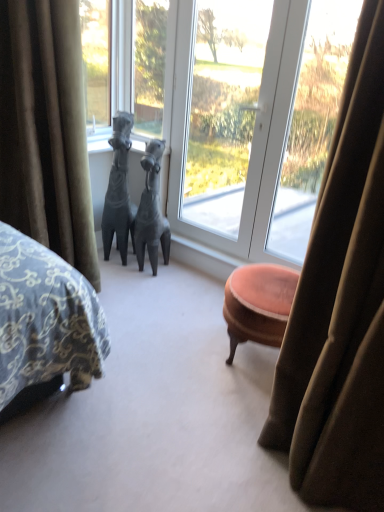
You are a GUI agent. You are given a task and a screenshot of the screen. Output one action in this format:
    pyautogui.click(x=<x>, y=<y>)
    Task: Click on the vacant space to the right of matte gray horse at center, which is counted as the second animal, starting from the left
    
    Given the screenshot: What is the action you would take?
    pyautogui.click(x=178, y=273)